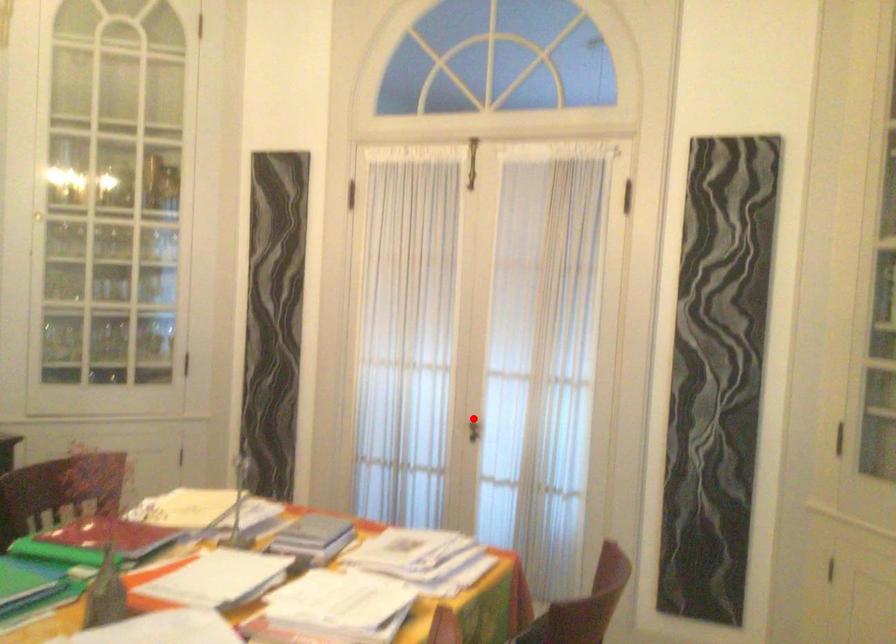
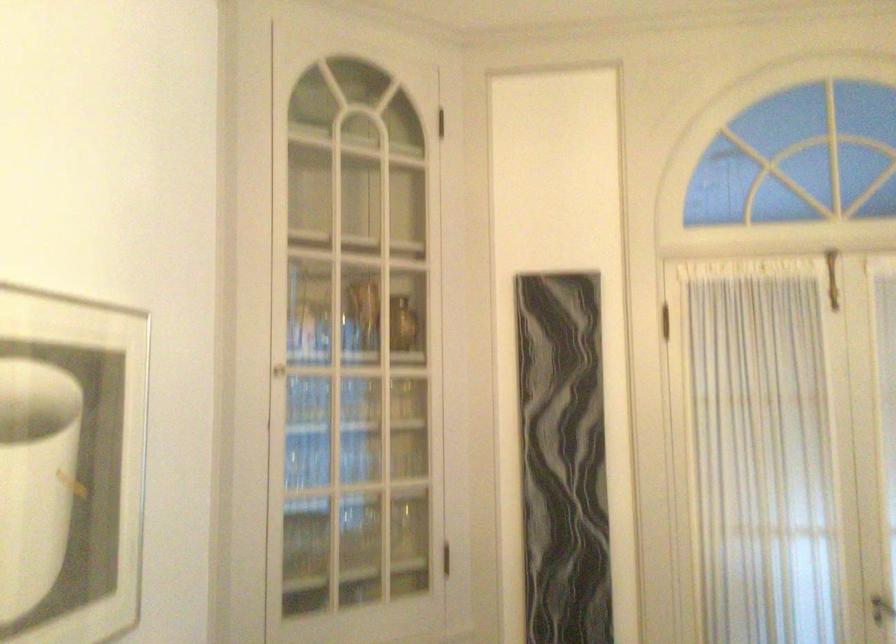
Question: I am providing you with two images of the same scene from different viewpoints. Image1 has a red point marked. In image2, the corresponding 3D location appears at what relative position? Reply with the corresponding letter.

Choices:
 (A) Closer
 (B) Farther

Answer: (A)